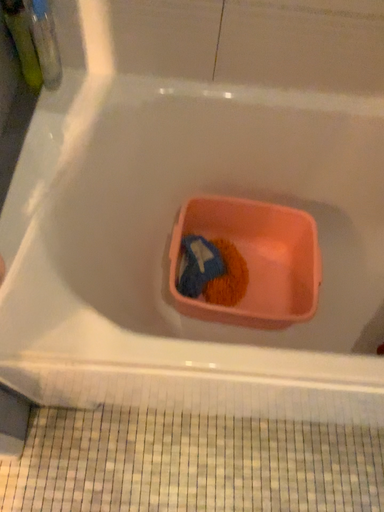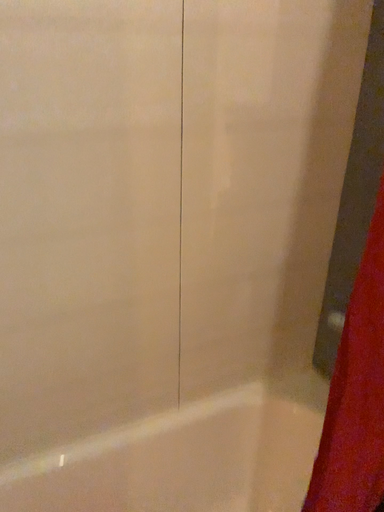
Question: Which way did the camera rotate in the video?

Choices:
 (A) rotated upward
 (B) rotated downward

Answer: (A)